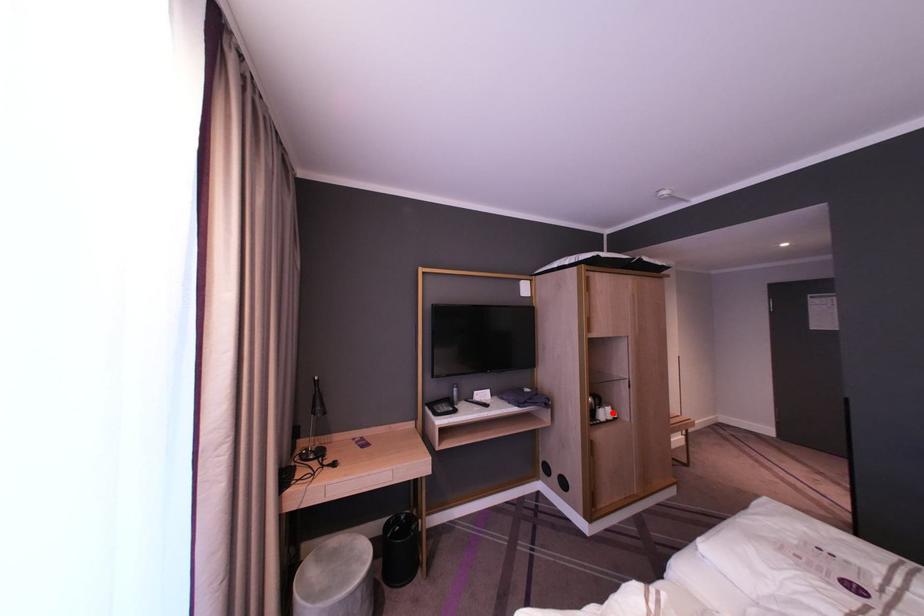
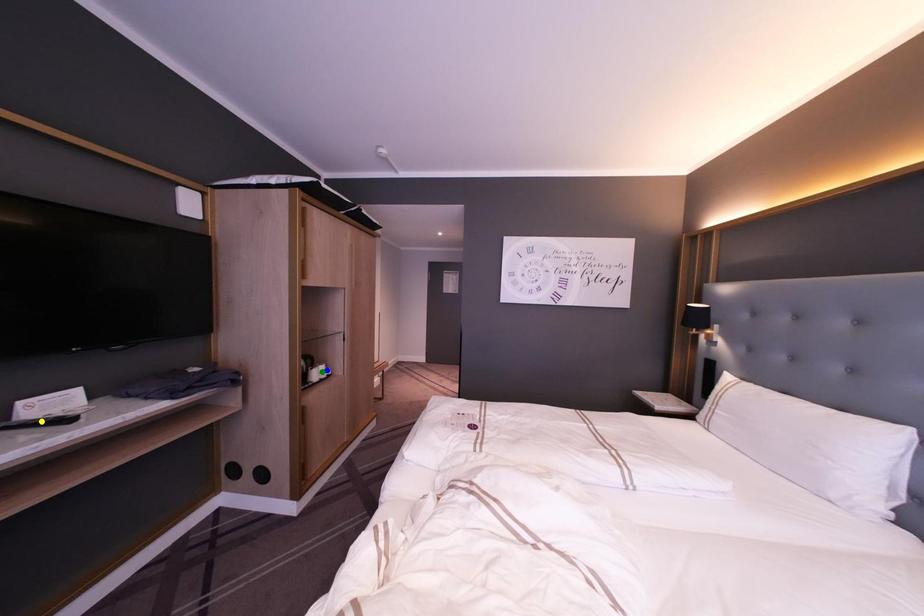
Question: I am providing you with two images of the same scene from different viewpoints. A red point is marked on the first image. You are given multiple points on the second image. Which mark in image 2 goes with the point in image 1?

Choices:
 (A) blue point
 (B) yellow point
 (C) green point

Answer: (A)